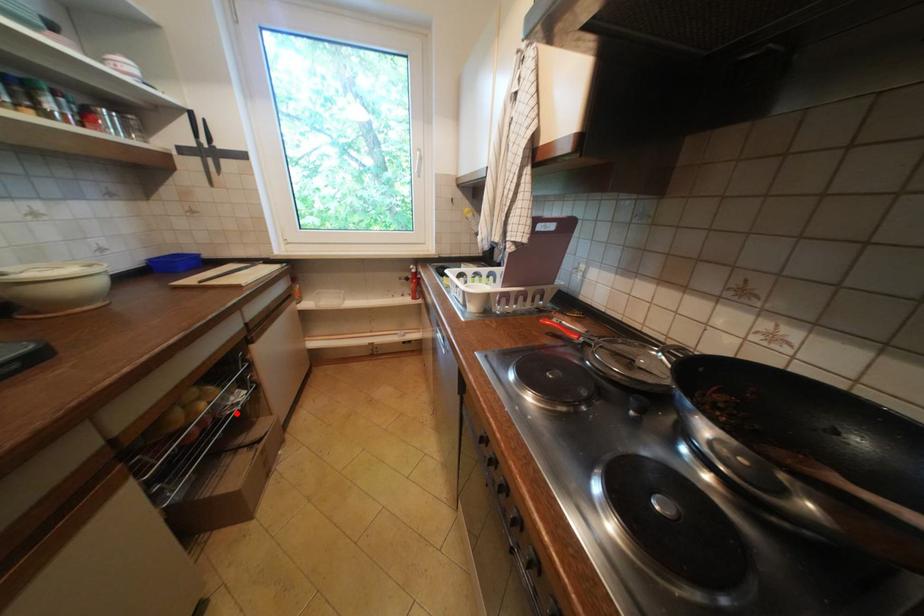
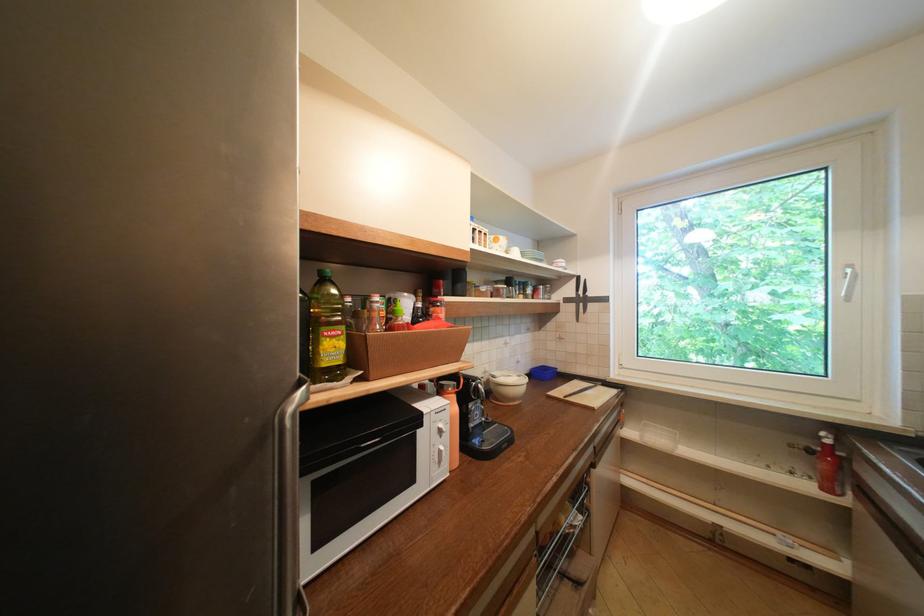
Locate, in the second image, the point that corresponds to the highlighted location in the first image.

(576, 532)